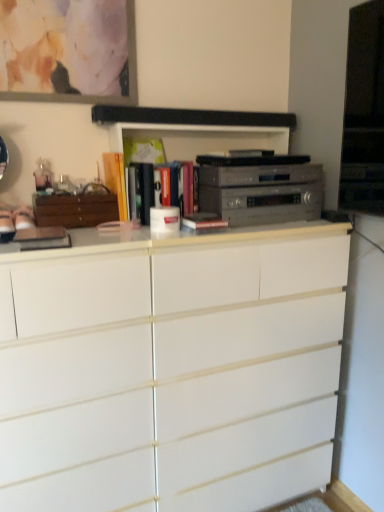
Locate an element on the screen. Image resolution: width=384 pixels, height=512 pixels. vacant space to the right of hardcover book at center, positioned as the 4th book in left-to-right order is located at coordinates (252, 230).